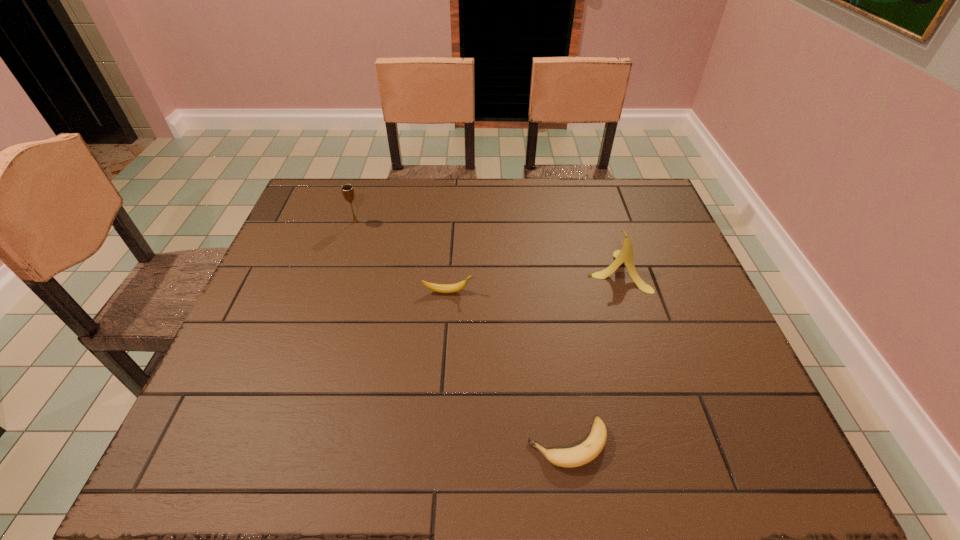
The image size is (960, 540). Identify the location of vacant area situated 0.380m at the stem of the third object from right to left. (623, 292).

Locate an element on the screen. free space located on the left of the third object from left to right is located at coordinates (428, 444).

You are a GUI agent. You are given a task and a screenshot of the screen. Output one action in this format:
    pyautogui.click(x=<x>, y=<y>)
    Task: Click on the object at the far edge
    
    Given the screenshot: What is the action you would take?
    pyautogui.click(x=347, y=190)

The width and height of the screenshot is (960, 540). I want to click on object located in the near edge section of the desktop, so click(577, 456).

The image size is (960, 540). Identify the location of object present at the right edge. (625, 255).

Where is `vacant area at the far edge of the desktop`? vacant area at the far edge of the desktop is located at coordinates (594, 197).

This screenshot has width=960, height=540. Find the location of `free space at the left edge of the desktop`. free space at the left edge of the desktop is located at coordinates (333, 252).

The height and width of the screenshot is (540, 960). I want to click on vacant space at the right edge of the desktop, so click(665, 224).

You are a GUI agent. You are given a task and a screenshot of the screen. Output one action in this format:
    pyautogui.click(x=<x>, y=<y>)
    Task: Click on the vacant space at the far left corner
    
    Given the screenshot: What is the action you would take?
    pyautogui.click(x=354, y=181)

Identify the location of free space at the near right corner. The height and width of the screenshot is (540, 960). (701, 451).